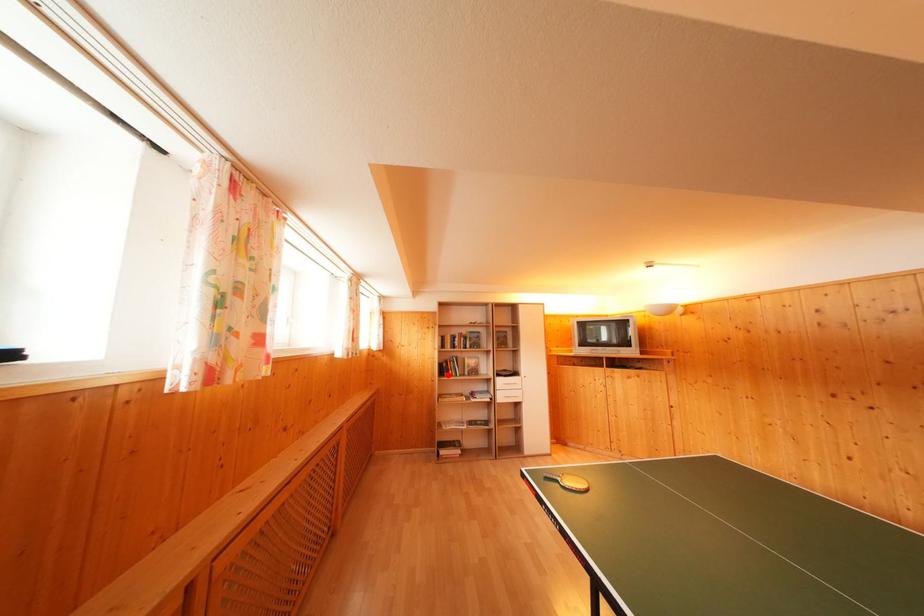
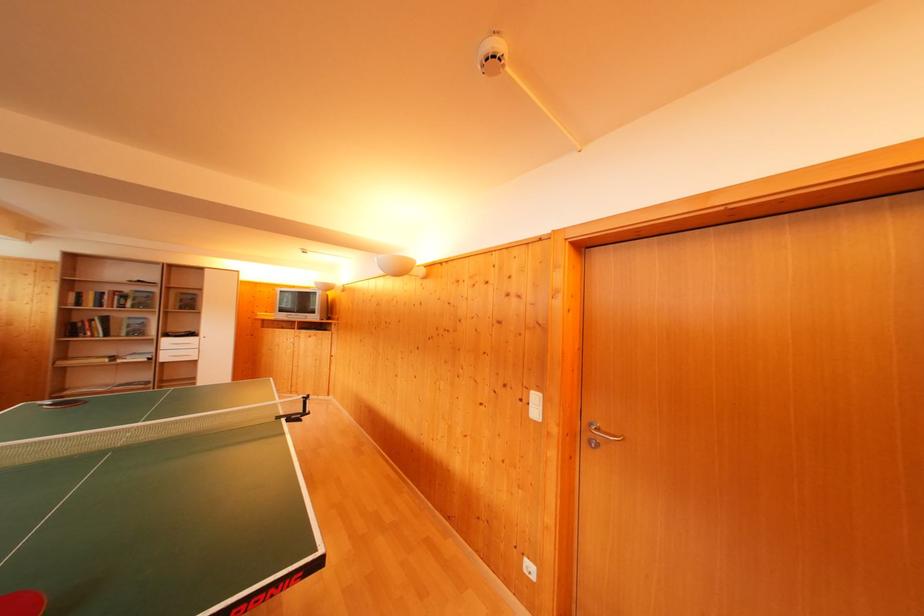
Locate, in the second image, the point that corresponds to the highlighted location in the first image.

(76, 334)